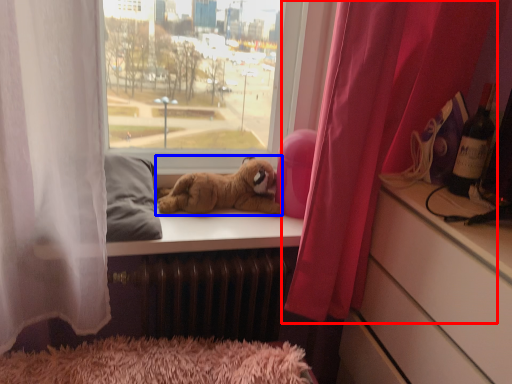
Question: Which of the following is the closest to the observer, curtain (highlighted by a red box) or dog (highlighted by a blue box)?

Choices:
 (A) curtain
 (B) dog

Answer: (A)